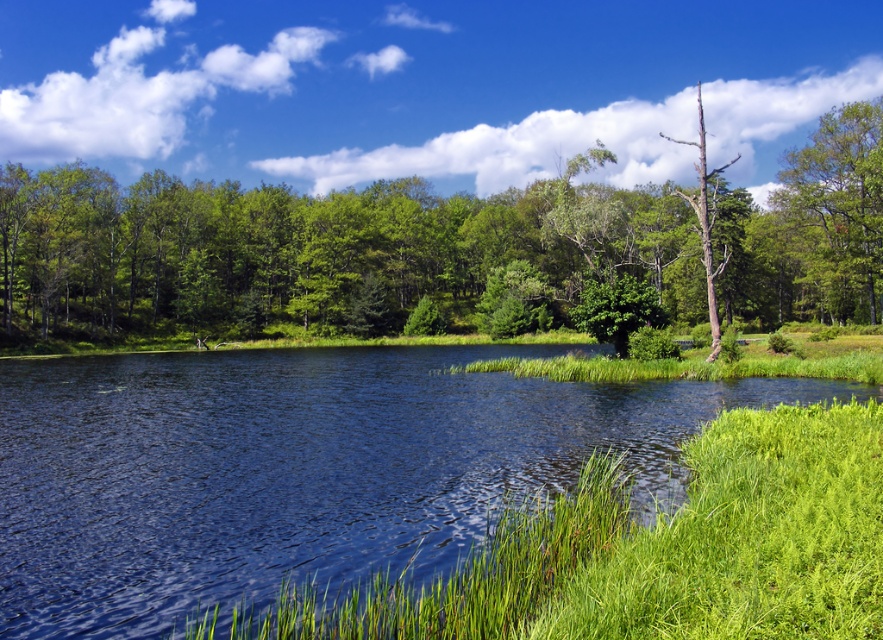
Does green leafy tree at center have a larger size compared to green leafy tree at upper right?

Indeed, green leafy tree at center has a larger size compared to green leafy tree at upper right.

Does point (802, 266) come farther from viewer compared to point (814, 147)?

Yes.

Identify the location of green leafy tree at center. (436, 248).

Does green leafy tree at center have a greater width compared to bare wood tree at right?

Yes, green leafy tree at center is wider than bare wood tree at right.

Does point (140, 333) come closer to viewer compared to point (697, 225)?

Yes, point (140, 333) is closer to viewer.

Where is `green leafy tree at center`? The height and width of the screenshot is (640, 883). green leafy tree at center is located at coordinates (x=436, y=248).

Is blue water at center positioned at the back of green leafy tree at upper right?

No, it is in front of green leafy tree at upper right.

The image size is (883, 640). What do you see at coordinates (298, 468) in the screenshot?
I see `blue water at center` at bounding box center [298, 468].

At what (x,y) coordinates should I click in order to perform the action: click on blue water at center. Please return your answer as a coordinate pair (x, y). Looking at the image, I should click on (298, 468).